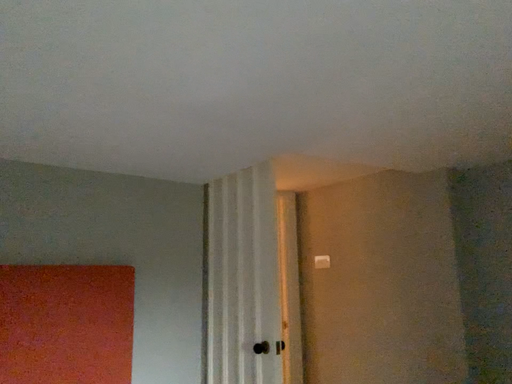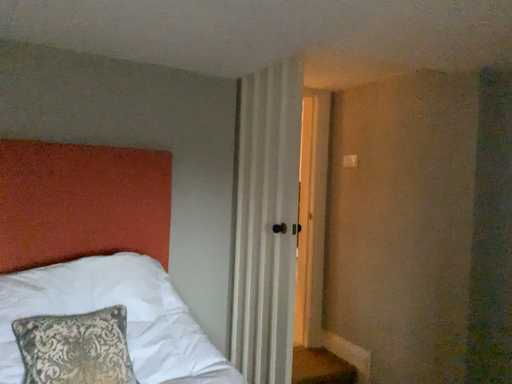
Question: How did the camera likely rotate when shooting the video?

Choices:
 (A) rotated left
 (B) rotated right

Answer: (A)